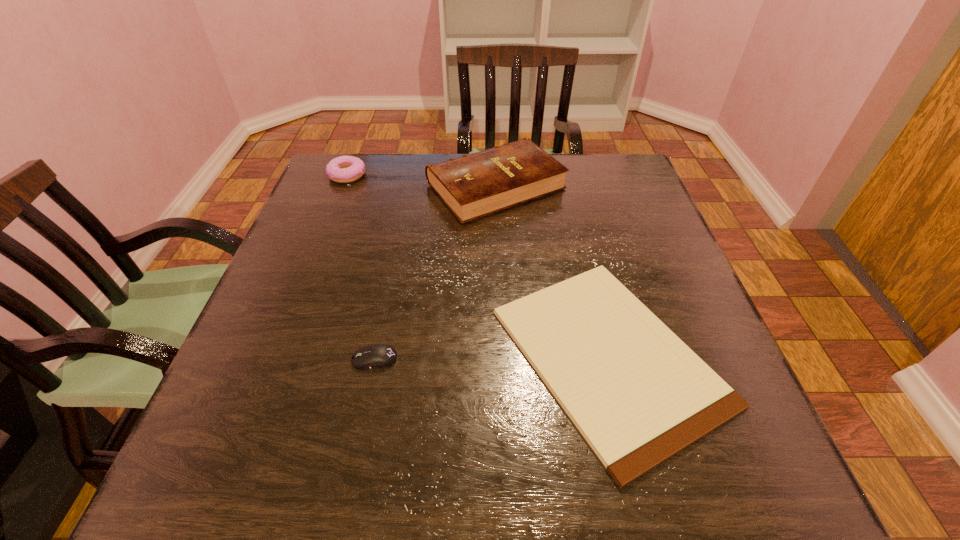
Where is `free spot at the right edge of the desktop`? free spot at the right edge of the desktop is located at coordinates (621, 260).

In the image, there is a desktop. What are the coordinates of `vacant region at the far left corner` in the screenshot? It's located at (371, 158).

Where is `free spot at the near left corner of the desktop`? The height and width of the screenshot is (540, 960). free spot at the near left corner of the desktop is located at coordinates (216, 502).

In the image, there is a desktop. Where is `free space at the far right corner`? This screenshot has height=540, width=960. free space at the far right corner is located at coordinates (648, 198).

Where is `free region at the near right corner of the desktop`? Image resolution: width=960 pixels, height=540 pixels. free region at the near right corner of the desktop is located at coordinates (680, 460).

This screenshot has width=960, height=540. Identify the location of vacant space that's between the clipboard and the hardback book. (552, 271).

At what (x,y) coordinates should I click in order to perform the action: click on empty space between the second shortest object and the leftmost object. Please return your answer as a coordinate pair (x, y). Looking at the image, I should click on (361, 267).

Locate an element on the screen. This screenshot has width=960, height=540. vacant space that's between the computer equipment and the shortest object is located at coordinates (492, 357).

Find the location of `free space between the third tallest object and the doughnut`. free space between the third tallest object and the doughnut is located at coordinates (361, 267).

Where is `vacant space that's between the computer equipment and the leftmost object`? This screenshot has width=960, height=540. vacant space that's between the computer equipment and the leftmost object is located at coordinates (361, 267).